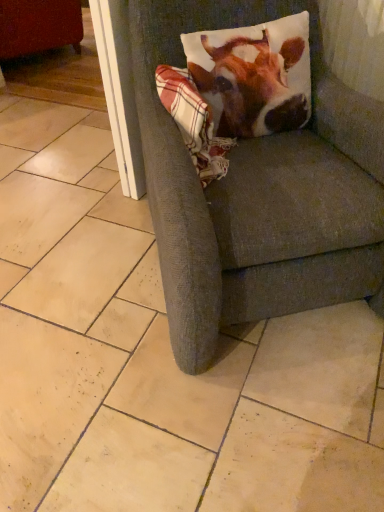
Question: Is plaid fabric at upper right in front of or behind matte red swivel chair at upper left in the image?

Choices:
 (A) front
 (B) behind

Answer: (A)

Question: From their relative heights in the image, would you say plaid fabric at upper right is taller or shorter than matte red swivel chair at upper left?

Choices:
 (A) tall
 (B) short

Answer: (B)

Question: Which of these objects is positioned closest to the matte red swivel chair at upper left?

Choices:
 (A) plaid fabric at upper right
 (B) white glossy screen door at upper left
 (C) printed fabric pillow at upper right
 (D) textured gray armchair at center

Answer: (B)

Question: Estimate the real-world distances between objects in this image. Which object is closer to the textured gray armchair at center?

Choices:
 (A) plaid fabric at upper right
 (B) printed fabric pillow at upper right
 (C) white glossy screen door at upper left
 (D) matte red swivel chair at upper left

Answer: (A)